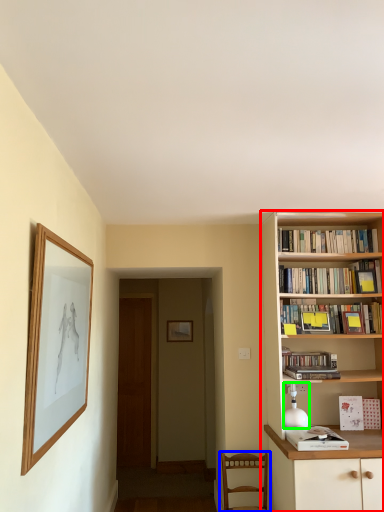
Question: Estimate the real-world distances between objects in this image. Which object is farther from bookcase (highlighted by a red box), chair (highlighted by a blue box) or lamp (highlighted by a green box)?

Choices:
 (A) chair
 (B) lamp

Answer: (A)